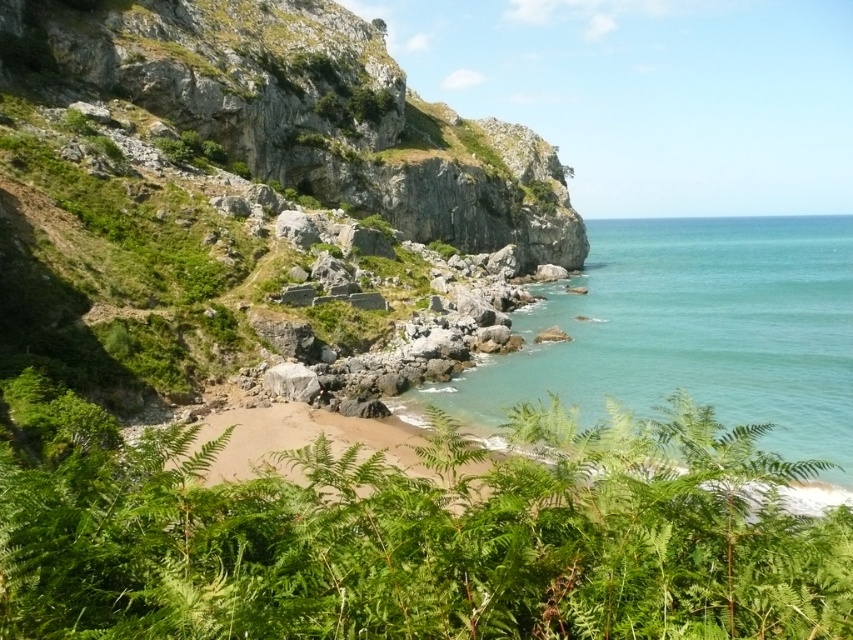
Question: Is green leafy ferns at lower center below clear blue water at lower right?

Choices:
 (A) no
 (B) yes

Answer: (B)

Question: Can you confirm if green leafy ferns at lower center is positioned above clear blue water at lower right?

Choices:
 (A) no
 (B) yes

Answer: (A)

Question: Among these points, which one is farthest from the camera?

Choices:
 (A) (494, 385)
 (B) (415, 516)

Answer: (A)

Question: Among these objects, which one is farthest from the camera?

Choices:
 (A) green leafy ferns at lower center
 (B) clear blue water at lower right

Answer: (B)

Question: Is green leafy ferns at lower center positioned before clear blue water at lower right?

Choices:
 (A) yes
 (B) no

Answer: (A)

Question: Which point is closer to the camera?

Choices:
 (A) (361, 529)
 (B) (466, 397)

Answer: (A)